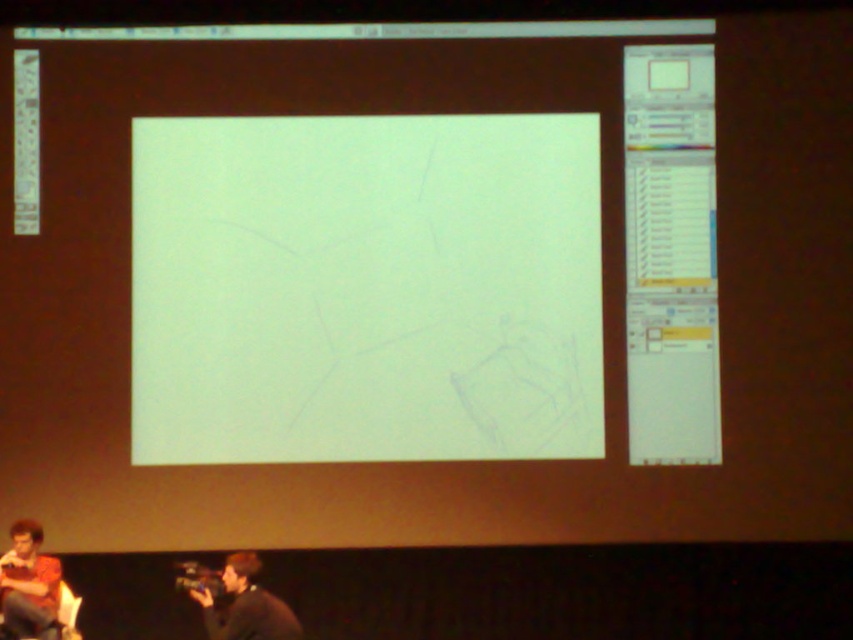
Who is taller, matte orange shirt at lower left or dark gray sweater at lower center?

With more height is matte orange shirt at lower left.

Is matte orange shirt at lower left above dark gray sweater at lower center?

Indeed, matte orange shirt at lower left is positioned over dark gray sweater at lower center.

Where is `matte orange shirt at lower left`? Image resolution: width=853 pixels, height=640 pixels. matte orange shirt at lower left is located at coordinates (28, 584).

Is white paper at center behind matte orange shirt at lower left?

Answer: Yes, white paper at center is further from the viewer.

Does white paper at center have a lesser height compared to matte orange shirt at lower left?

In fact, white paper at center may be taller than matte orange shirt at lower left.

Is point (170, 387) in front of point (26, 595)?

That is False.

Locate an element on the screen. The image size is (853, 640). white paper at center is located at coordinates (364, 289).

Where is `white paper at center`? The width and height of the screenshot is (853, 640). white paper at center is located at coordinates [x=364, y=289].

Can you confirm if white paper at center is taller than dark gray sweater at lower center?

Yes, white paper at center is taller than dark gray sweater at lower center.

What are the coordinates of `white paper at center` in the screenshot? It's located at (364, 289).